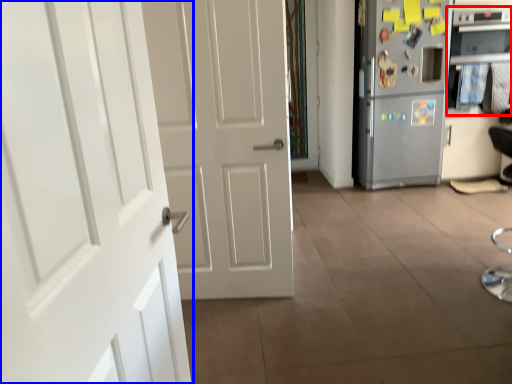
Question: Which of the following is the closest to the observer, oven (highlighted by a red box) or door (highlighted by a blue box)?

Choices:
 (A) oven
 (B) door

Answer: (B)